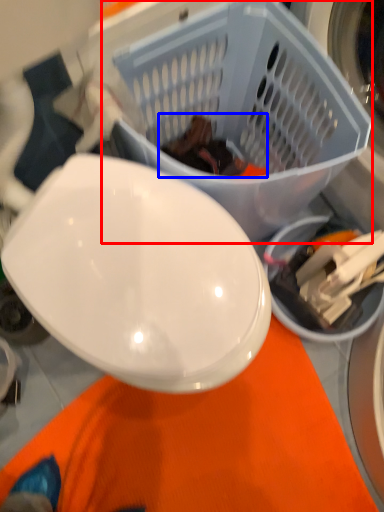
Question: Which object appears farthest to the camera in this image, basket (highlighted by a red box) or food (highlighted by a blue box)?

Choices:
 (A) basket
 (B) food

Answer: (B)